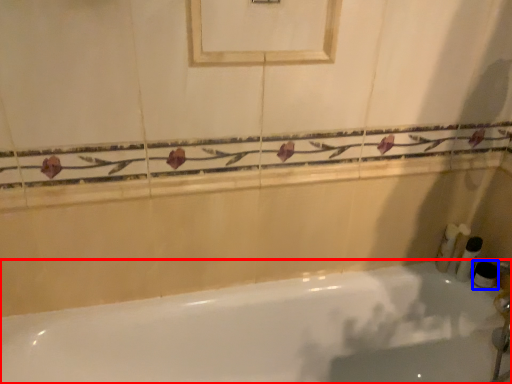
Question: Which of the following is the farthest to the observer, bathtub (highlighted by a red box) or toiletry (highlighted by a blue box)?

Choices:
 (A) bathtub
 (B) toiletry

Answer: (B)